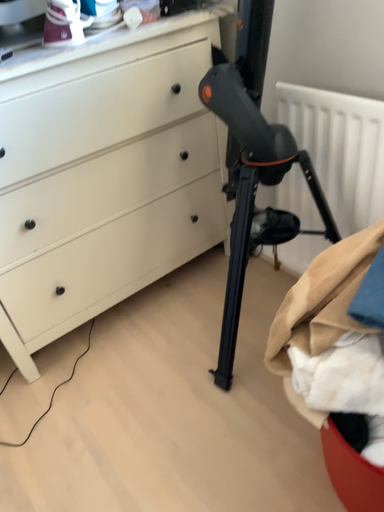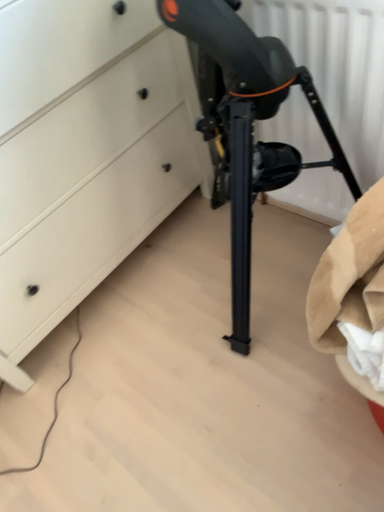
Question: How did the camera likely rotate when shooting the video?

Choices:
 (A) rotated downward
 (B) rotated upward

Answer: (A)